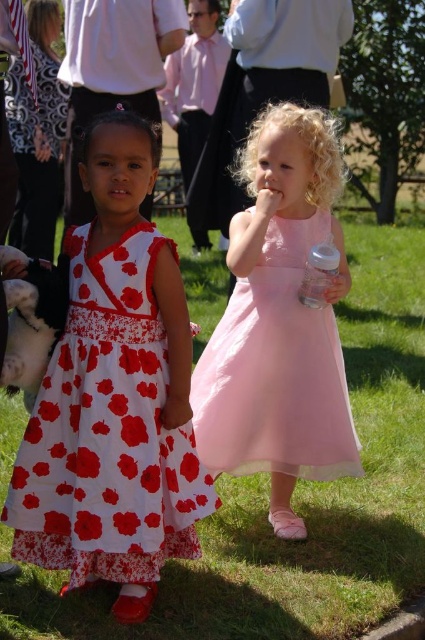
Question: Based on their relative distances, which object is farther from the white floral dress at left?

Choices:
 (A) green grass at lower center
 (B) pink tulle dress at center

Answer: (A)

Question: Which point is farther to the camera?

Choices:
 (A) (323, 257)
 (B) (82, 241)
 (C) (260, 372)
 (D) (362, 496)

Answer: (D)

Question: Can you confirm if green grass at lower center is bigger than transparent plastic bottle at right?

Choices:
 (A) yes
 (B) no

Answer: (A)

Question: Which object is farther from the camera taking this photo?

Choices:
 (A) pink tulle dress at center
 (B) white floral dress at left

Answer: (A)

Question: Can you confirm if green grass at lower center is wider than transparent plastic bottle at right?

Choices:
 (A) yes
 (B) no

Answer: (A)

Question: Can you confirm if white floral dress at left is positioned below transparent plastic bottle at right?

Choices:
 (A) no
 (B) yes

Answer: (B)